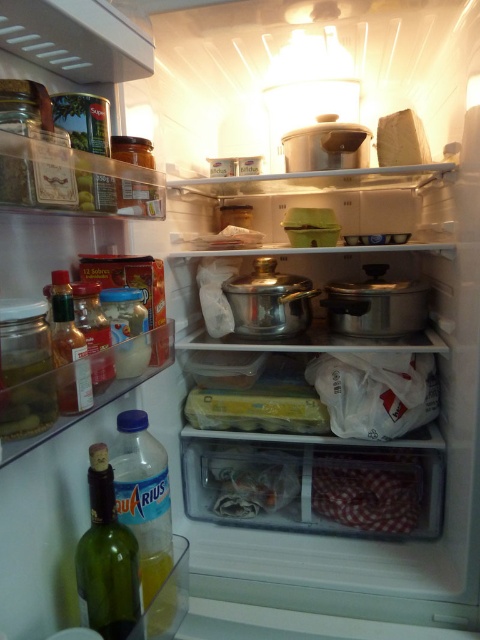
Question: Does clear plastic bottle at lower left appear over green glass bottle at lower left?

Choices:
 (A) no
 (B) yes

Answer: (A)

Question: Can you confirm if clear plastic bottle at lower left is wider than translucent glass bottle at left?

Choices:
 (A) yes
 (B) no

Answer: (A)

Question: Can you confirm if clear plastic bottle at lower left is wider than green glass bottle at lower left?

Choices:
 (A) no
 (B) yes

Answer: (B)

Question: Which of the following is the closest to the observer?

Choices:
 (A) (135, 417)
 (B) (103, 371)
 (C) (63, 333)

Answer: (C)

Question: Which point appears closest to the camera in this image?

Choices:
 (A) (90, 294)
 (B) (130, 424)

Answer: (A)

Question: Among these points, which one is farthest from the camera?

Choices:
 (A) (155, 500)
 (B) (94, 508)
 (C) (68, 310)

Answer: (A)